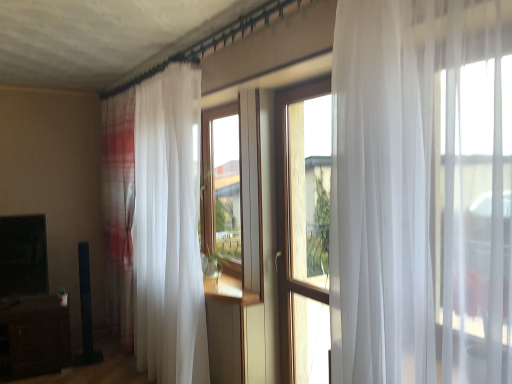
I want to click on vacant point above wooden window at center (from a real-world perspective), so click(303, 84).